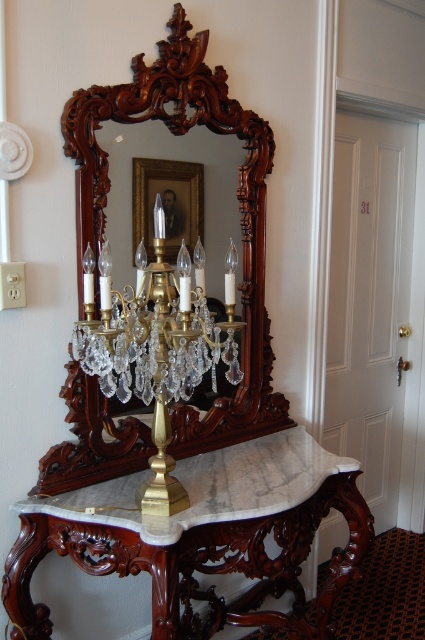
Between point (207, 516) and point (251, 435), which one is positioned in front?

Positioned in front is point (207, 516).

Is marble/carved wood table at center positioned in front of mahogany wood mirror at upper center?

Yes, it is.

Find the location of a particular element. marble/carved wood table at center is located at coordinates point(200,532).

Identify the location of marble/carved wood table at center. (200, 532).

Which is above, marble/carved wood table at center or brass/crystal chandelier at center?

Positioned higher is brass/crystal chandelier at center.

Does marble/carved wood table at center have a greater width compared to brass/crystal chandelier at center?

Indeed, marble/carved wood table at center has a greater width compared to brass/crystal chandelier at center.

This screenshot has height=640, width=425. Describe the element at coordinates (200, 532) in the screenshot. I see `marble/carved wood table at center` at that location.

Find the location of a particular element. The image size is (425, 640). marble/carved wood table at center is located at coordinates (200, 532).

Is mahogany wood mirror at upper center thinner than brass/crystal chandelier at center?

Incorrect, mahogany wood mirror at upper center's width is not less than brass/crystal chandelier at center's.

Between mahogany wood mirror at upper center and brass/crystal chandelier at center, which one is positioned higher?

mahogany wood mirror at upper center is above.

The height and width of the screenshot is (640, 425). Identify the location of mahogany wood mirror at upper center. [x=238, y=196].